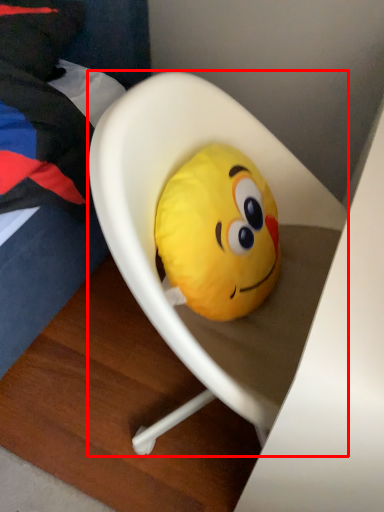
Question: Considering the relative positions of furniture (annotated by the red box) and toy in the image provided, where is furniture (annotated by the red box) located with respect to the staircase?

Choices:
 (A) right
 (B) left

Answer: (A)